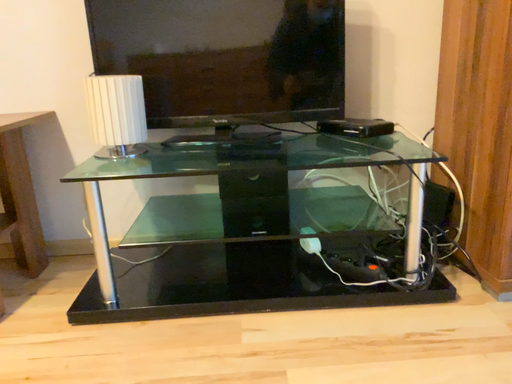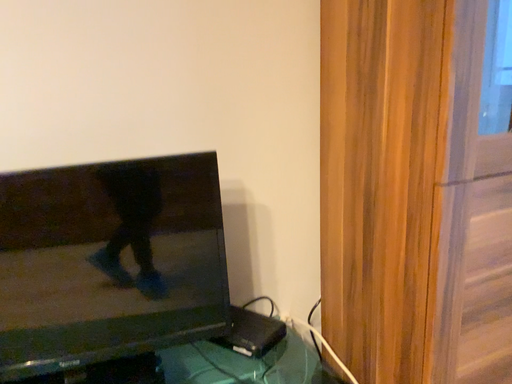
Question: Which way did the camera rotate in the video?

Choices:
 (A) rotated left
 (B) rotated right

Answer: (B)